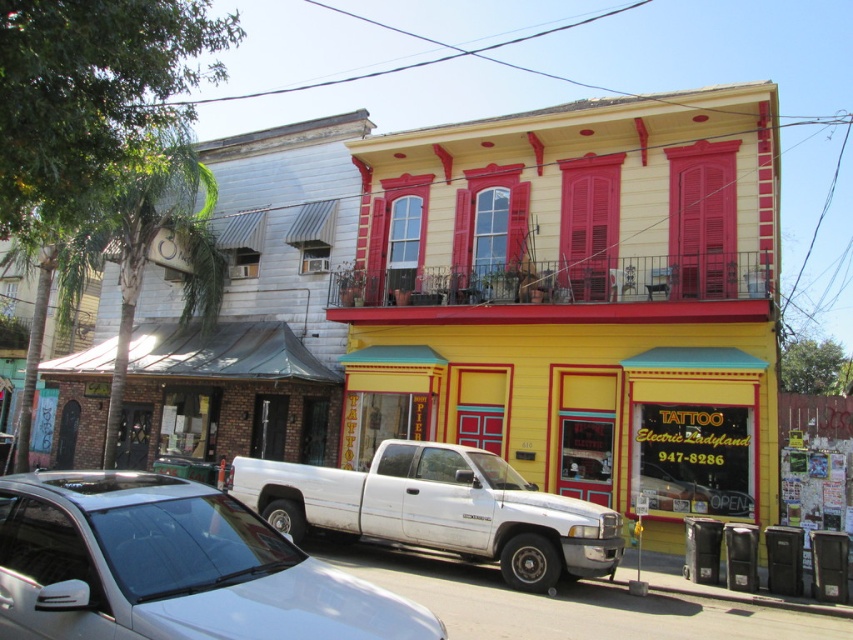
You are a delivery driver who needs to park your white matte truck at center in front of the red matte shutter at upper center. Is the truck positioned in a way that allows you to park directly in front of the shutter?

The white matte truck at center is closer to the viewer than the red matte shutter at upper center, so it is already positioned in front of the shutter and can be parked there.

You are standing at point (577, 301) in the image. What building are you in front of?

You are in front of the yellow matte building at center located at point (577, 301).